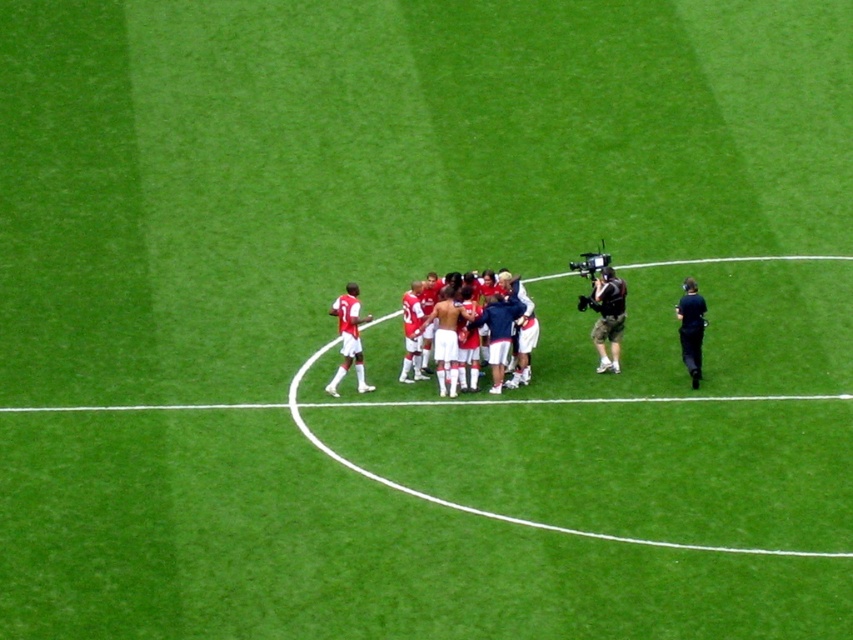
You are a photographer standing at the edge of the field. You want to take a photo that includes both the red matte soccer players at center and the black fabric referee at right. Given that your camera has a maximum focus range of 7 feet, will you be able to capture both subjects in focus?

The red matte soccer players at center and the black fabric referee at right are 7.30 feet apart from each other. Since the distance between them exceeds the camera s 7 feet focus range, you won t be able to capture both subjects in focus simultaneously.